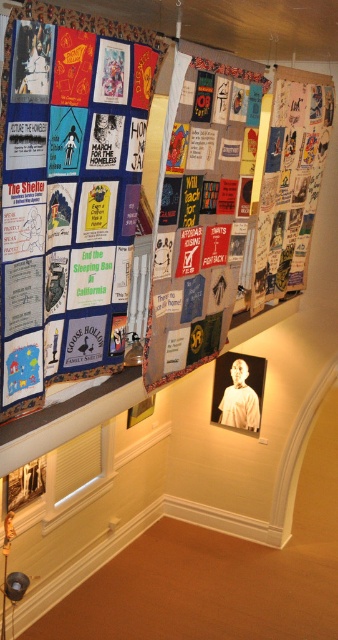
Question: Can you confirm if textile collage at upper center is smaller than textured fabric posters at upper right?

Choices:
 (A) yes
 (B) no

Answer: (A)

Question: Which object is the closest to the white matte portrait at center?

Choices:
 (A) textile collage at upper left
 (B) textile collage at upper center

Answer: (B)

Question: Estimate the real-world distances between objects in this image. Which object is closer to the textured fabric posters at upper right?

Choices:
 (A) textile collage at upper center
 (B) white matte portrait at center
 (C) textile collage at upper left

Answer: (A)

Question: Is textile collage at upper left to the left of textured fabric posters at upper right from the viewer's perspective?

Choices:
 (A) no
 (B) yes

Answer: (B)

Question: Among these objects, which one is nearest to the camera?

Choices:
 (A) textured fabric posters at upper right
 (B) textile collage at upper center
 (C) textile collage at upper left

Answer: (C)

Question: Can you confirm if textured fabric posters at upper right is positioned to the left of white matte portrait at center?

Choices:
 (A) no
 (B) yes

Answer: (A)